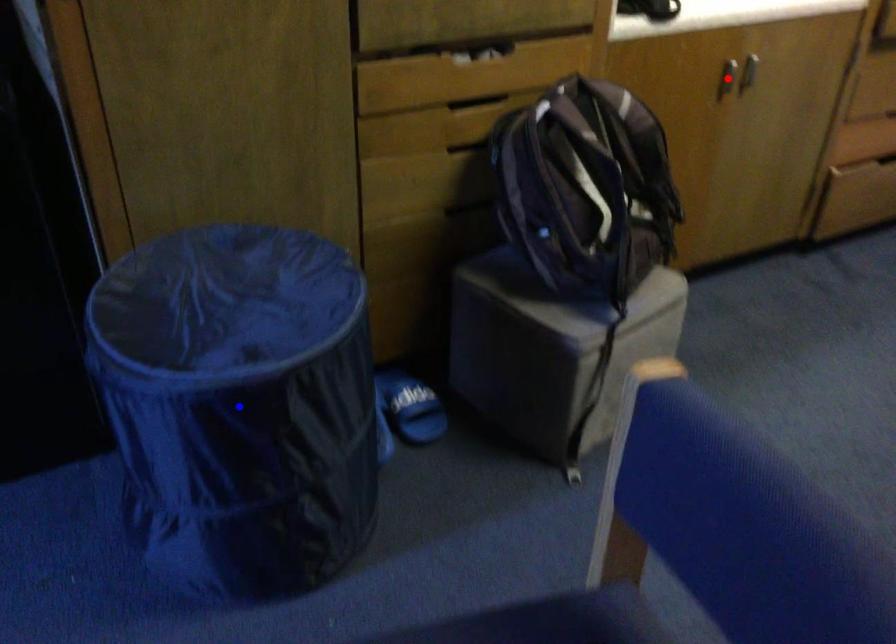
Question: Which of the two points in the image is closer to the camera?

Choices:
 (A) Blue point is closer.
 (B) Red point is closer.

Answer: (A)